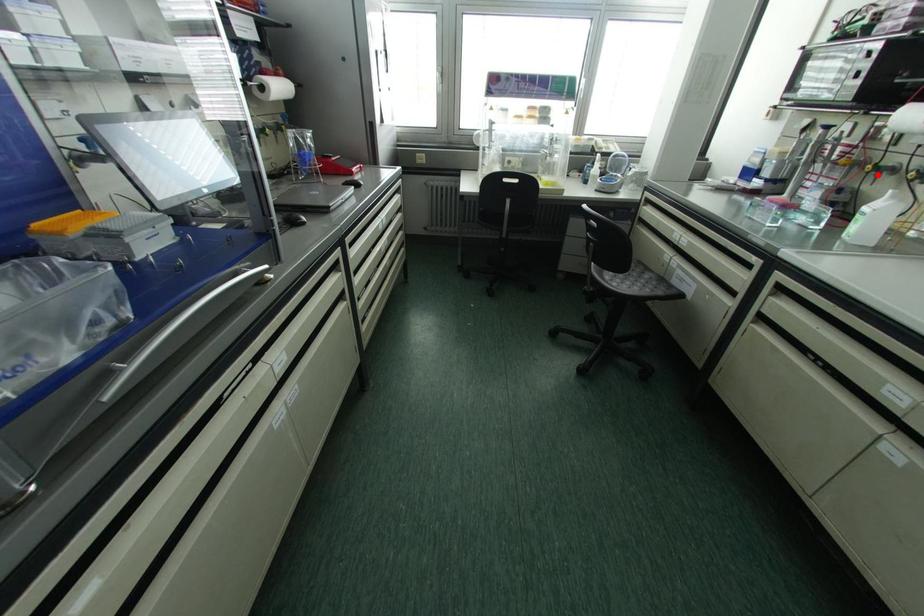
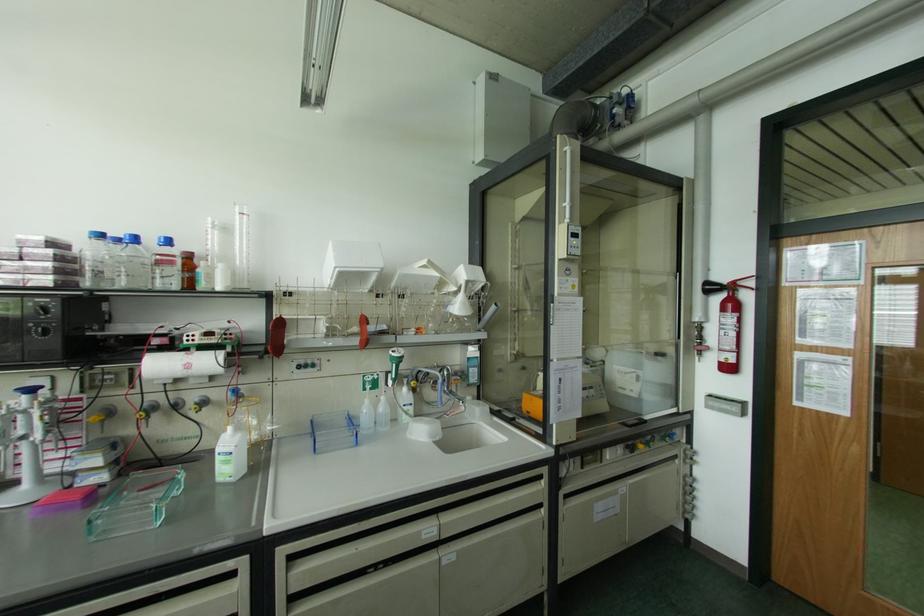
Where in the second image is the point corresponding to the highlighted location from the first image?

(148, 416)